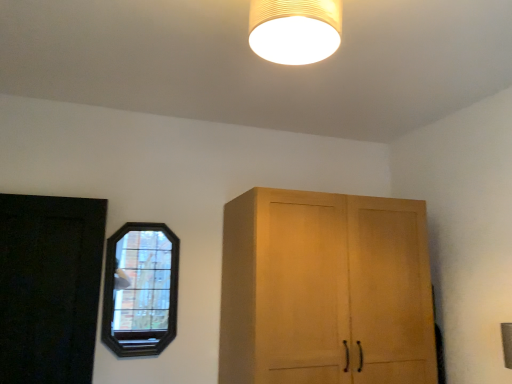
The image size is (512, 384). In order to click on matte beige lampshade at upper center in this screenshot , I will do `click(295, 30)`.

Describe the element at coordinates (49, 287) in the screenshot. The width and height of the screenshot is (512, 384). I see `black matte door at left` at that location.

From the picture: Measure the distance between point (x=24, y=230) and camera.

Point (x=24, y=230) and camera are 7.12 feet apart from each other.

This screenshot has height=384, width=512. I want to click on dark wood stained window at left, so click(140, 289).

At what (x,y) coordinates should I click in order to perform the action: click on matte beige lampshade at upper center. Please return your answer as a coordinate pair (x, y). Image resolution: width=512 pixels, height=384 pixels. Looking at the image, I should click on (x=295, y=30).

Find the location of a particular element. window located behind the black matte door at left is located at coordinates (140, 289).

Is dark wood stained window at left located within black matte door at left?

No, dark wood stained window at left is not inside black matte door at left.

Is black matte door at left far away from dark wood stained window at left?

black matte door at left is actually quite close to dark wood stained window at left.

What's the angular difference between black matte door at left and matte beige lampshade at upper center's facing directions?

92.7 degrees separate the facing orientations of black matte door at left and matte beige lampshade at upper center.

From the image's perspective, between black matte door at left and matte beige lampshade at upper center, who is located below?

From the image's view, black matte door at left is below.

Which object is further away from the camera, black matte door at left or matte beige lampshade at upper center?

black matte door at left is further away from the camera.

Consider the image. Is dark wood stained window at left positioned far away from matte beige lampshade at upper center?

Yes, dark wood stained window at left is far from matte beige lampshade at upper center.

Which is behind, dark wood stained window at left or matte beige lampshade at upper center?

dark wood stained window at left is further from the camera.

Between dark wood stained window at left and matte beige lampshade at upper center, which one has less height?

matte beige lampshade at upper center.

Is dark wood stained window at left completely or partially outside of matte beige lampshade at upper center?

That's correct, dark wood stained window at left is outside of matte beige lampshade at upper center.

From a real-world perspective, who is located higher, dark wood stained window at left or black matte door at left?

From a 3D spatial view, dark wood stained window at left is above.

Image resolution: width=512 pixels, height=384 pixels. I want to click on door below the dark wood stained window at left (from a real-world perspective), so click(49, 287).

From the image's perspective, is dark wood stained window at left located above black matte door at left?

No, from the image's perspective, dark wood stained window at left is not above black matte door at left.

From a real-world perspective, who is located higher, matte beige lampshade at upper center or black matte door at left?

matte beige lampshade at upper center is physically above.

Considering the points (254, 7) and (35, 351), which point is behind, point (254, 7) or point (35, 351)?

The point (35, 351) is farther from the camera.

Looking at this image, from their relative heights in the image, would you say matte beige lampshade at upper center is taller or shorter than dark wood stained window at left?

In the image, matte beige lampshade at upper center appears to be shorter than dark wood stained window at left.

Is matte beige lampshade at upper center next to dark wood stained window at left?

No, matte beige lampshade at upper center is not making contact with dark wood stained window at left.

From the image's perspective, who appears lower, matte beige lampshade at upper center or dark wood stained window at left?

dark wood stained window at left is shown below in the image.

Looking at this image, from a real-world perspective, is matte beige lampshade at upper center physically located above or below dark wood stained window at left?

Clearly, from a real-world perspective, matte beige lampshade at upper center is above dark wood stained window at left.

Locate an element on the screen. window that appears above the black matte door at left (from a real-world perspective) is located at coordinates (140, 289).

This screenshot has height=384, width=512. What are the coordinates of `door that is behind the matte beige lampshade at upper center` in the screenshot? It's located at (49, 287).

Estimate the real-world distances between objects in this image. Which object is further from matte beige lampshade at upper center, black matte door at left or dark wood stained window at left?

Among the two, black matte door at left is located further to matte beige lampshade at upper center.

Estimate the real-world distances between objects in this image. Which object is closer to black matte door at left, dark wood stained window at left or matte beige lampshade at upper center?

dark wood stained window at left.

Considering their positions, is matte beige lampshade at upper center positioned closer to dark wood stained window at left than black matte door at left?

black matte door at left lies closer to dark wood stained window at left than the other object.

From the image, which object appears to be nearer to dark wood stained window at left, black matte door at left or matte beige lampshade at upper center?

Among the two, black matte door at left is located nearer to dark wood stained window at left.

Which object lies nearer to the anchor point matte beige lampshade at upper center, dark wood stained window at left or black matte door at left?

dark wood stained window at left lies closer to matte beige lampshade at upper center than the other object.

Based on their spatial positions, is matte beige lampshade at upper center or dark wood stained window at left closer to black matte door at left?

The object closer to black matte door at left is dark wood stained window at left.

This screenshot has width=512, height=384. Find the location of `door located between matte beige lampshade at upper center and dark wood stained window at left in the depth direction`. door located between matte beige lampshade at upper center and dark wood stained window at left in the depth direction is located at coordinates (49, 287).